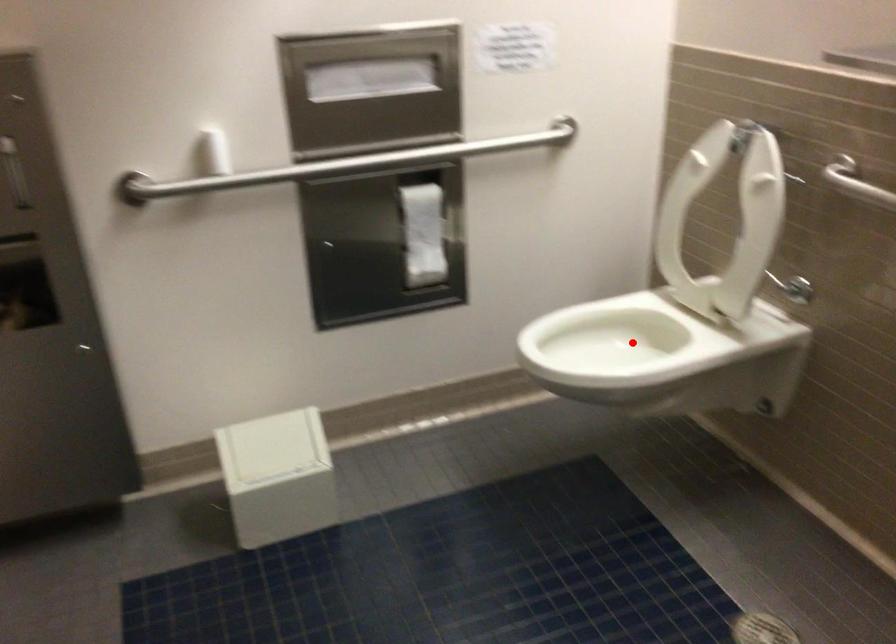
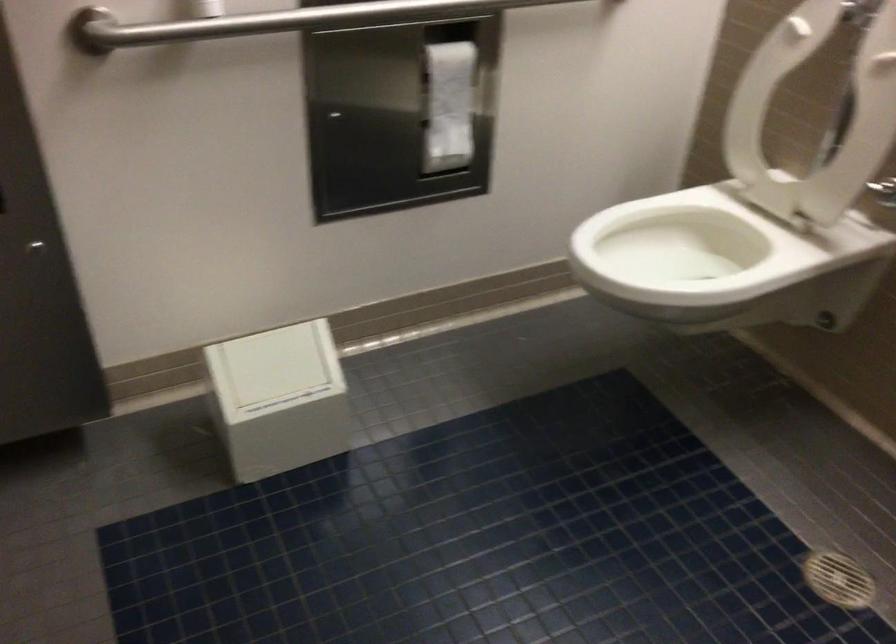
In the second image, find the point that corresponds to the highlighted location in the first image.

(684, 245)